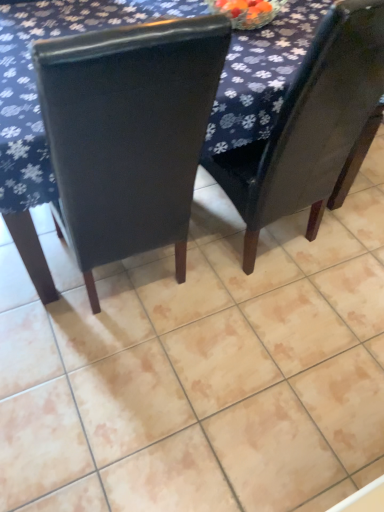
The height and width of the screenshot is (512, 384). What are the coordinates of `free location in front of matte black chair at center, which appears as the 1th chair when viewed from the left` in the screenshot? It's located at (132, 396).